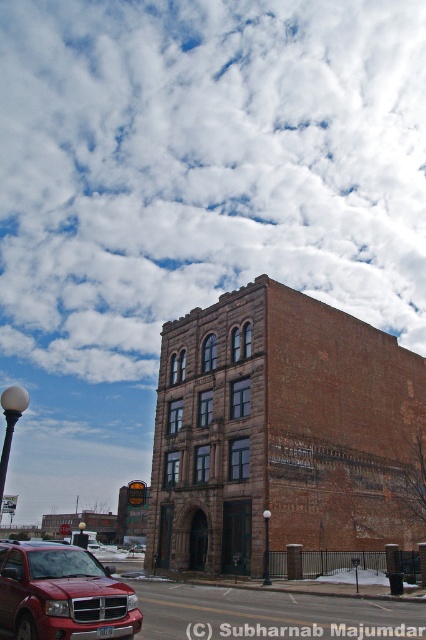
Question: Where is matte red suv at lower left located in relation to metallic red suv at lower left in the image?

Choices:
 (A) below
 (B) above

Answer: (B)

Question: Which object is the closest to the metallic red suv at lower left?

Choices:
 (A) matte red suv at lower left
 (B) white fluffy cloud at upper center

Answer: (A)

Question: Which point is closer to the camera taking this photo?

Choices:
 (A) (98, 627)
 (B) (85, 208)
 (C) (137, 544)

Answer: (A)

Question: Is white fluffy cloud at upper center bigger than matte red suv at lower left?

Choices:
 (A) no
 (B) yes

Answer: (B)

Question: Which object is farther from the camera taking this photo?

Choices:
 (A) white fluffy cloud at upper center
 (B) matte red suv at lower left

Answer: (A)

Question: Is white fluffy cloud at upper center closer to the viewer compared to matte red suv at lower left?

Choices:
 (A) no
 (B) yes

Answer: (A)